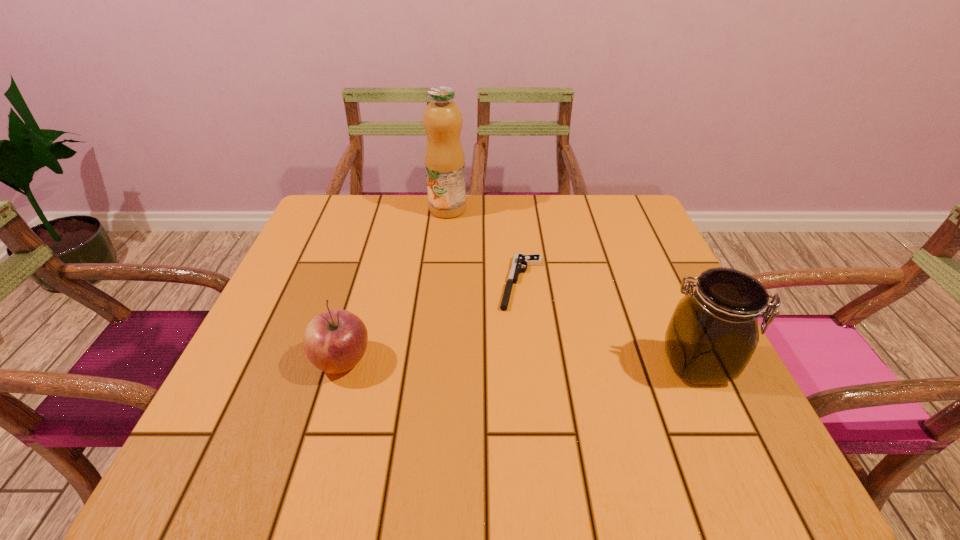
At what (x,y) coordinates should I click in order to perform the action: click on object present at the near left corner. Please return your answer as a coordinate pair (x, y). The height and width of the screenshot is (540, 960). Looking at the image, I should click on (334, 341).

Identify the location of object that is at the near right corner. The image size is (960, 540). (713, 333).

The image size is (960, 540). I want to click on free space at the far edge of the desktop, so click(413, 207).

Where is `free space at the near edge of the desktop`? free space at the near edge of the desktop is located at coordinates (579, 406).

Where is `vacant space at the left edge of the desktop`? This screenshot has width=960, height=540. vacant space at the left edge of the desktop is located at coordinates (325, 249).

Locate an element on the screen. This screenshot has width=960, height=540. vacant area at the right edge is located at coordinates (643, 276).

Find the location of a particular element. vacant space at the far left corner of the desktop is located at coordinates (331, 197).

Where is `vacant space at the far right corner`? The width and height of the screenshot is (960, 540). vacant space at the far right corner is located at coordinates (658, 237).

I want to click on vacant region between the apple and the second object from left to right, so click(x=395, y=285).

I want to click on free spot between the third nearest object and the second tallest object, so click(609, 323).